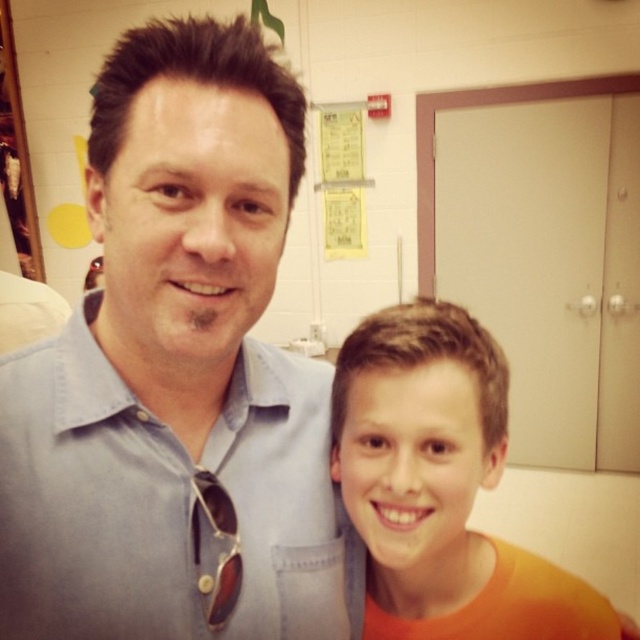
You are a tailor who needs to determine which shirt requires more fabric for alterations. Based on the image, which shirt between the light blue cotton shirt at upper left and the orange matte shirt at right needs more fabric?

The orange matte shirt at right requires more fabric for alterations because it is thicker than the light blue cotton shirt at upper left.

Based on the scene description, which object has a smaller height between the light blue cotton shirt at upper left and the orange matte shirt at right?

The light blue cotton shirt at upper left has a lesser height compared to the orange matte shirt at right.

You are trying to decide which shirt to wear for a casual day out. You see the light blue cotton shirt at upper left and the orange matte shirt at right in the image. Which shirt is located to the left of the other?

The light blue cotton shirt at upper left is positioned on the left side of orange matte shirt at right.